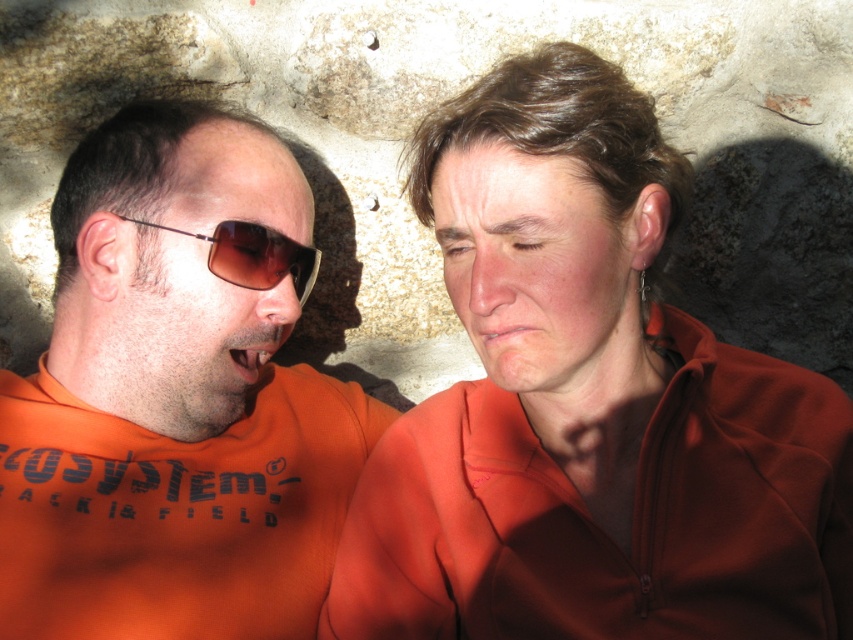
Question: Is matte orange teeth at center wider than dry matte lips at center?

Choices:
 (A) yes
 (B) no

Answer: (B)

Question: Which point appears closest to the camera in this image?

Choices:
 (A) (229, 362)
 (B) (497, 336)
 (C) (495, 269)

Answer: (C)

Question: Which point is closer to the camera?

Choices:
 (A) brown translucent plastic sunglasses at left
 (B) matte orange jacket at center

Answer: (B)

Question: Considering the relative positions of matte orange jacket at center and matte orange teeth at center in the image provided, where is matte orange jacket at center located with respect to matte orange teeth at center?

Choices:
 (A) above
 (B) below

Answer: (B)

Question: Is the position of matte orange jacket at center less distant than that of dry matte lips at center?

Choices:
 (A) no
 (B) yes

Answer: (B)

Question: Which point is closer to the camera taking this photo?

Choices:
 (A) (137, 364)
 (B) (309, 276)
 (C) (705, 365)

Answer: (C)